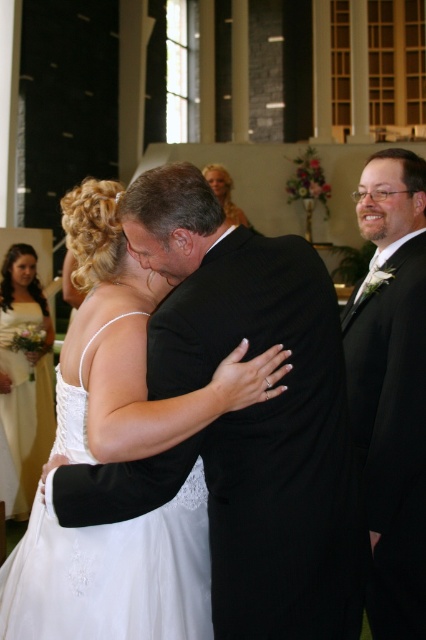
Who is lower down, white satin dress at center or black satin suit at right?

black satin suit at right is lower down.

Can you confirm if white satin dress at center is positioned to the right of black satin suit at right?

No, white satin dress at center is not to the right of black satin suit at right.

Is point (63, 586) more distant than point (394, 516)?

No, (63, 586) is in front of (394, 516).

The width and height of the screenshot is (426, 640). I want to click on white satin dress at center, so click(x=131, y=349).

Does white satin dress at center come in front of blonde hair at upper center?

Yes.

Between point (199, 492) and point (227, 172), which one is positioned behind?

Point (227, 172)

Locate an element on the screen. Image resolution: width=426 pixels, height=640 pixels. white satin dress at center is located at coordinates (131, 349).

Can you confirm if black satin suit at right is smaller than white satin dress at left?

Indeed, black satin suit at right has a smaller size compared to white satin dress at left.

Which is more to the left, black satin suit at right or white satin dress at left?

From the viewer's perspective, white satin dress at left appears more on the left side.

Describe the element at coordinates (391, 387) in the screenshot. The height and width of the screenshot is (640, 426). I see `black satin suit at right` at that location.

Identify the location of black satin suit at right. Image resolution: width=426 pixels, height=640 pixels. (391, 387).